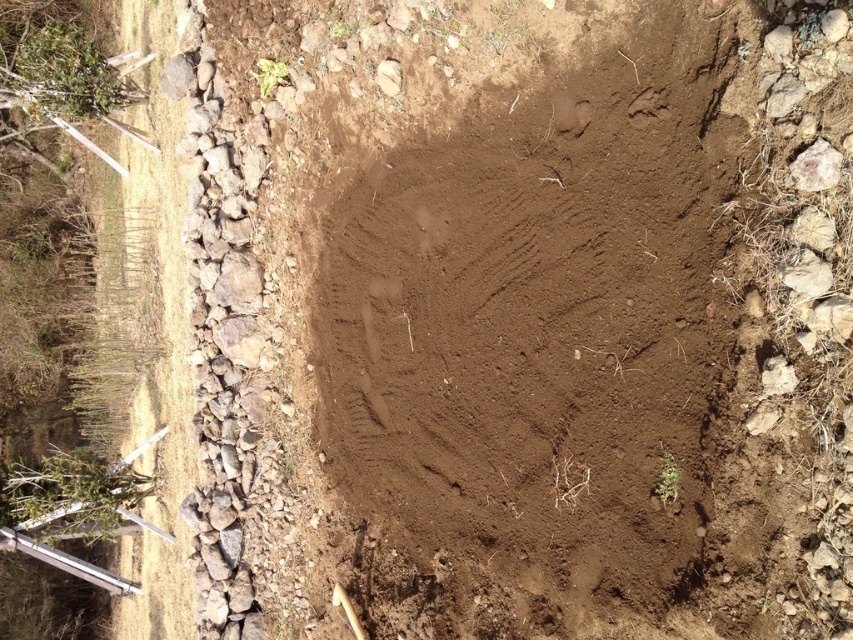
Question: Does brown soil at center have a greater width compared to brown rough rock at upper right?

Choices:
 (A) no
 (B) yes

Answer: (B)

Question: Which object is the farthest from the gray rock at right?

Choices:
 (A) brown soil at center
 (B) brown rough rock at upper right

Answer: (A)

Question: Which of the following is the closest to the observer?

Choices:
 (A) gray rock at right
 (B) brown soil at center
 (C) brown rough rock at upper right

Answer: (C)

Question: Does brown rough rock at upper right have a larger size compared to gray rock at right?

Choices:
 (A) yes
 (B) no

Answer: (B)

Question: Which point is closer to the camera?

Choices:
 (A) (804, 253)
 (B) (792, 172)

Answer: (A)

Question: Can you confirm if brown soil at center is bigger than brown rough rock at upper right?

Choices:
 (A) yes
 (B) no

Answer: (A)